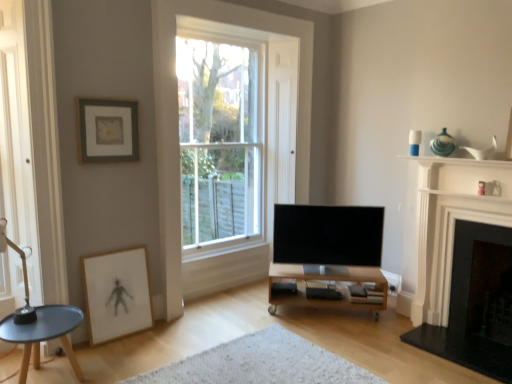
Question: Considering the positions of clear glass window at center and flat screen tv at center in the image, is clear glass window at center wider or thinner than flat screen tv at center?

Choices:
 (A) wide
 (B) thin

Answer: (B)

Question: In terms of size, does clear glass window at center appear bigger or smaller than flat screen tv at center?

Choices:
 (A) small
 (B) big

Answer: (B)

Question: Based on their relative distances, which object is nearer to the clear glass window at center?

Choices:
 (A) black matte speaker at lower center
 (B) white glossy vase at upper right
 (C) matte black coffee table at lower left
 (D) flat screen tv at center
 (E) matte gray picture frame at upper left, placed as the first picture frame when sorted from top to bottom

Answer: (D)

Question: Which of these objects is positioned farthest from the matte gray picture frame at upper left, placed as the first picture frame when sorted from top to bottom?

Choices:
 (A) white textured rug at center
 (B) wooden tv stand at center
 (C) dark gray stone fireplace at right, placed as the 2th fireplace when sorted from left to right
 (D) white marble fireplace at right, which is the second fireplace from right to left
 (E) flat screen tv at center

Answer: (C)